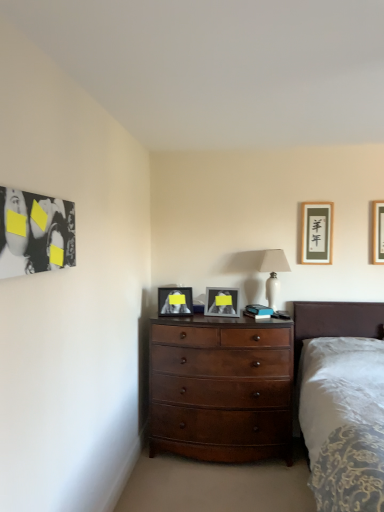
Locate an element on the screen. The image size is (384, 512). matte black picture frame at upper right, the second picture frame positioned from the right is located at coordinates (316, 233).

Measure the distance between point (208, 305) and camera.

Point (208, 305) and camera are 3.54 meters apart.

Describe the element at coordinates (334, 321) in the screenshot. I see `white soft bed at right` at that location.

Find the location of `white ceramic lamp at upper center`. white ceramic lamp at upper center is located at coordinates (273, 273).

Between wooden picture frame at upper right, the fourth picture frame in the left-to-right sequence, and white ceramic lamp at upper center, which one appears on the left side from the viewer's perspective?

Positioned to the left is white ceramic lamp at upper center.

Can you confirm if wooden picture frame at upper right, marked as the 1th picture frame in a right-to-left arrangement, is bigger than white ceramic lamp at upper center?

Incorrect, wooden picture frame at upper right, marked as the 1th picture frame in a right-to-left arrangement, is not larger than white ceramic lamp at upper center.

Considering the sizes of wooden picture frame at upper right, marked as the 1th picture frame in a right-to-left arrangement, and white ceramic lamp at upper center in the image, is wooden picture frame at upper right, marked as the 1th picture frame in a right-to-left arrangement, taller or shorter than white ceramic lamp at upper center?

wooden picture frame at upper right, marked as the 1th picture frame in a right-to-left arrangement, is shorter than white ceramic lamp at upper center.

From the image's perspective, between wooden picture frame at upper right, the fourth picture frame in the left-to-right sequence, and white ceramic lamp at upper center, which one is located above?

wooden picture frame at upper right, the fourth picture frame in the left-to-right sequence, appears higher in the image.

Considering the sizes of objects mahogany wood dresser at center and white soft bed at right in the image provided, who is bigger, mahogany wood dresser at center or white soft bed at right?

Bigger between the two is white soft bed at right.

At what (x,y) coordinates should I click in order to perform the action: click on bed that is below the mahogany wood dresser at center (from the image's perspective). Please return your answer as a coordinate pair (x, y). Looking at the image, I should click on (334, 321).

Does mahogany wood dresser at center appear on the left side of white soft bed at right?

Indeed, mahogany wood dresser at center is positioned on the left side of white soft bed at right.

Is mahogany wood dresser at center taller than white soft bed at right?

No.

Can you see matte gray picture frame at center, which is the 2th picture frame in left-to-right order, touching matte black picture frame at upper right, the second picture frame positioned from the right?

matte gray picture frame at center, which is the 2th picture frame in left-to-right order, is not next to matte black picture frame at upper right, the second picture frame positioned from the right, and they're not touching.

From a real-world perspective, which is physically above, matte gray picture frame at center, the 3th picture frame positioned from the right, or matte black picture frame at upper right, the second picture frame positioned from the right?

In real-world perspective, matte black picture frame at upper right, the second picture frame positioned from the right, is above.

Is matte gray picture frame at center, the 3th picture frame positioned from the right, wider or thinner than matte black picture frame at upper right, the second picture frame positioned from the right?

Clearly, matte gray picture frame at center, the 3th picture frame positioned from the right, has more width compared to matte black picture frame at upper right, the second picture frame positioned from the right.

From a real-world perspective, is mahogany wood dresser at center over white ceramic lamp at upper center?

No.

What are the coordinates of `lamp that is above the mahogany wood dresser at center (from a real-world perspective)` in the screenshot? It's located at (273, 273).

Is mahogany wood dresser at center positioned with its back to white ceramic lamp at upper center?

mahogany wood dresser at center does not have its back to white ceramic lamp at upper center.

From the image's perspective, is mahogany wood dresser at center above or below white ceramic lamp at upper center?

mahogany wood dresser at center is situated lower than white ceramic lamp at upper center in the image.

From a real-world perspective, who is located higher, white ceramic lamp at upper center or matte gray picture frame at center, the 3th picture frame positioned from the right?

white ceramic lamp at upper center, from a real-world perspective.

Which object is further away from the camera taking this photo, white ceramic lamp at upper center or matte gray picture frame at center, which is the 2th picture frame in left-to-right order?

white ceramic lamp at upper center.

Considering the relative sizes of white ceramic lamp at upper center and matte gray picture frame at center, the 3th picture frame positioned from the right, in the image provided, is white ceramic lamp at upper center smaller than matte gray picture frame at center, the 3th picture frame positioned from the right,?

No.

Does white soft bed at right contain matte gray picture frame at center, the 3th picture frame positioned from the right?

No, white soft bed at right does not contain matte gray picture frame at center, the 3th picture frame positioned from the right.

Can you confirm if white soft bed at right is bigger than matte gray picture frame at center, which is the 2th picture frame in left-to-right order?

Correct, white soft bed at right is larger in size than matte gray picture frame at center, which is the 2th picture frame in left-to-right order.

Based on the photo, from the image's perspective, is white soft bed at right under matte gray picture frame at center, the 3th picture frame positioned from the right?

Indeed, from the image's perspective, white soft bed at right is shown beneath matte gray picture frame at center, the 3th picture frame positioned from the right.

Could you tell me if matte black picture frame at upper right, the second picture frame positioned from the right, is turned towards matte gray picture frame at center, the 3th picture frame positioned from the right?

No.

Do you think matte black picture frame at upper right, the 3th picture frame when ordered from left to right, is within matte gray picture frame at center, which is the 2th picture frame in left-to-right order, or outside of it?

matte black picture frame at upper right, the 3th picture frame when ordered from left to right, is spatially situated outside matte gray picture frame at center, which is the 2th picture frame in left-to-right order.

Is matte black picture frame at upper right, the second picture frame positioned from the right, not near matte gray picture frame at center, the 3th picture frame positioned from the right?

matte black picture frame at upper right, the second picture frame positioned from the right, is near matte gray picture frame at center, the 3th picture frame positioned from the right, not far away.

I want to click on the 2nd picture frame counting from the right of the white ceramic lamp at upper center, so click(378, 232).

You are a GUI agent. You are given a task and a screenshot of the screen. Output one action in this format:
    pyautogui.click(x=<x>, y=<y>)
    Task: Click on the chest of drawers behind the white soft bed at right
    
    Given the screenshot: What is the action you would take?
    pyautogui.click(x=221, y=389)

Estimate the real-world distances between objects in this image. Which object is further from matte gray picture frame at center, which is the 2th picture frame in left-to-right order, white ceramic lamp at upper center or wooden picture frame at upper right, the fourth picture frame in the left-to-right sequence?

wooden picture frame at upper right, the fourth picture frame in the left-to-right sequence.

Considering their positions, is mahogany wood dresser at center positioned closer to white ceramic lamp at upper center than white soft bed at right?

white soft bed at right is closer to white ceramic lamp at upper center.

Which object lies further to the anchor point matte black picture frame at upper right, the 3th picture frame when ordered from left to right, white ceramic lamp at upper center or matte gray picture frame at center, which is the 2th picture frame in left-to-right order?

matte gray picture frame at center, which is the 2th picture frame in left-to-right order, is further to matte black picture frame at upper right, the 3th picture frame when ordered from left to right.

Looking at the image, which one is located closer to white soft bed at right, wooden picture frame at upper right, marked as the 1th picture frame in a right-to-left arrangement, or matte black picture frame at upper right, the second picture frame positioned from the right?

Among the two, matte black picture frame at upper right, the second picture frame positioned from the right, is located nearer to white soft bed at right.

Looking at the image, which one is located further to white soft bed at right, matte gray picture frame at center, the 3th picture frame positioned from the right, or matte black picture frame at center, which is the fourth picture frame in right-to-left order?

matte black picture frame at center, which is the fourth picture frame in right-to-left order, is positioned further to the anchor white soft bed at right.

Based on their spatial positions, is matte black picture frame at center, the 1th picture frame in the left-to-right sequence, or white soft bed at right closer to mahogany wood dresser at center?

matte black picture frame at center, the 1th picture frame in the left-to-right sequence, lies closer to mahogany wood dresser at center than the other object.

Which object lies further to the anchor point matte black picture frame at center, the 1th picture frame in the left-to-right sequence, mahogany wood dresser at center or wooden picture frame at upper right, the fourth picture frame in the left-to-right sequence?

wooden picture frame at upper right, the fourth picture frame in the left-to-right sequence, is positioned further to the anchor matte black picture frame at center, the 1th picture frame in the left-to-right sequence.

Based on their spatial positions, is white ceramic lamp at upper center or matte black picture frame at center, which is the fourth picture frame in right-to-left order, closer to white soft bed at right?

white ceramic lamp at upper center.

Identify the location of picture frame between matte gray picture frame at center, which is the 2th picture frame in left-to-right order, and mahogany wood dresser at center from top to bottom. (175, 301).

Locate an element on the screen. chest of drawers between matte black picture frame at center, the 1th picture frame in the left-to-right sequence, and wooden picture frame at upper right, the fourth picture frame in the left-to-right sequence is located at coordinates (221, 389).

Identify the location of chest of drawers between matte black picture frame at center, which is the fourth picture frame in right-to-left order, and matte black picture frame at upper right, the 3th picture frame when ordered from left to right, from left to right. (221, 389).

Locate an element on the screen. The height and width of the screenshot is (512, 384). lamp located between white soft bed at right and matte black picture frame at upper right, the 3th picture frame when ordered from left to right, in the depth direction is located at coordinates (273, 273).